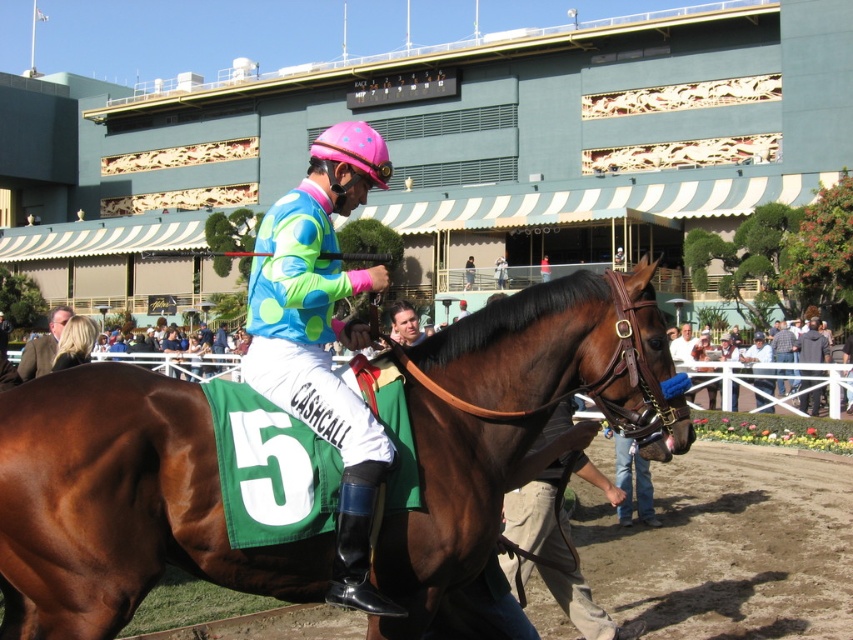
Question: Which point appears closest to the camera in this image?

Choices:
 (A) (650, 580)
 (B) (810, 330)
 (C) (788, 348)
 (D) (782, 340)

Answer: (A)

Question: Does white cotton shirt at center appear on the left side of denim jacket at right?

Choices:
 (A) yes
 (B) no

Answer: (A)

Question: Which object appears closest to the camera in this image?

Choices:
 (A) brown dirt track at center
 (B) denim jacket at right
 (C) brown leather jacket at lower left

Answer: (A)

Question: Does brown glossy horse at center appear over neon polka dot jersey at center?

Choices:
 (A) yes
 (B) no

Answer: (B)

Question: Which point is farther from the camera taking this photo?

Choices:
 (A) (467, 515)
 (B) (807, 330)

Answer: (B)

Question: Is brown dirt track at center smaller than neon polka dot jersey at center?

Choices:
 (A) no
 (B) yes

Answer: (A)